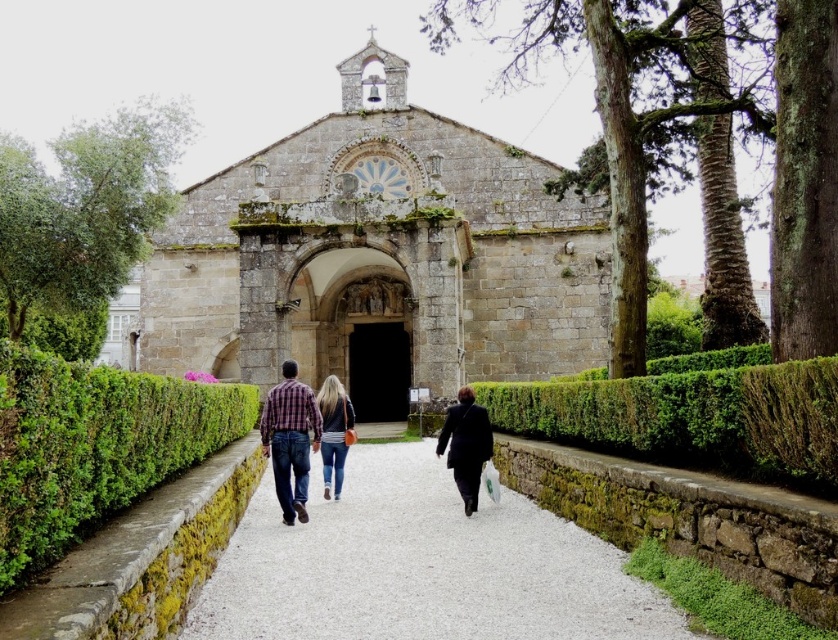
You are a visitor at the historic stone church and want to place your dark blue fabric coat at center on the ground. However, there is a green leafy hedge at lower right nearby. Which object is wider so you can decide where to place your coat?

The green leafy hedge at lower right might be wider than dark blue fabric coat at center, so placing the coat near the hedge may not be ideal due to space constraints.

You are standing at the entrance of the historic stone church and notice two green leafy hedges. One is labeled as the green leafy hedge at center and the other as the green leafy hedge at lower right. Which hedge is positioned higher up relative to the other?

The green leafy hedge at lower right is positioned higher up than the green leafy hedge at center because the green leafy hedge at center is located below it.